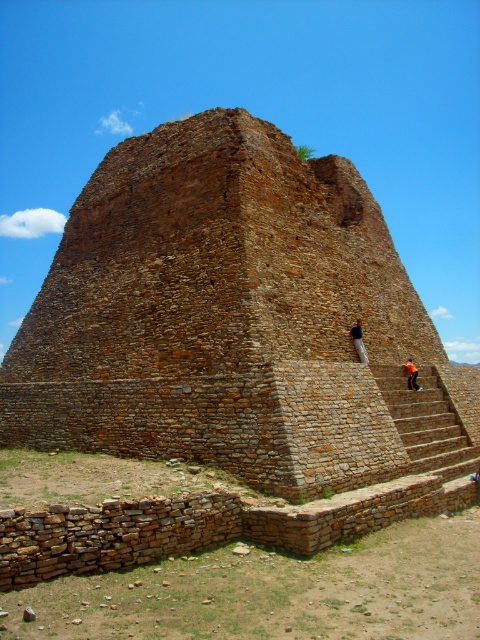
Question: Is brown stone ruins at center bigger than orange fabric person at upper right?

Choices:
 (A) yes
 (B) no

Answer: (A)

Question: Can you confirm if brown stone ruins at center is thinner than dark brown stone person at upper center?

Choices:
 (A) yes
 (B) no

Answer: (B)

Question: From the image, what is the correct spatial relationship of dark brown stone person at upper center in relation to orange fabric person at upper right?

Choices:
 (A) right
 (B) left

Answer: (B)

Question: Which point is farther to the camera?

Choices:
 (A) orange fabric person at upper right
 (B) brown stone ruins at center

Answer: (A)

Question: Which point is farther from the camera taking this photo?

Choices:
 (A) (360, 321)
 (B) (419, 387)

Answer: (A)

Question: Which point appears farthest from the camera in this image?

Choices:
 (A) (360, 324)
 (B) (407, 358)
 (C) (132, 272)

Answer: (B)